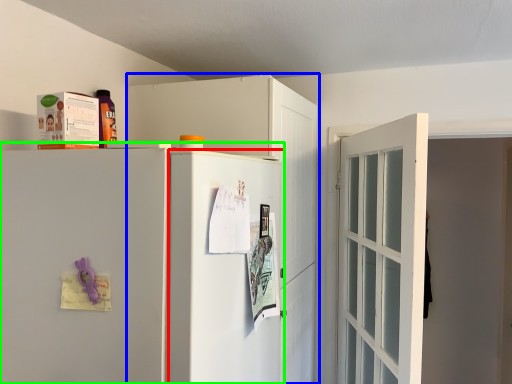
Question: Which is nearer to the screen door (highlighted by a red box)? cabinetry (highlighted by a blue box) or refrigerator (highlighted by a green box).

Choices:
 (A) cabinetry
 (B) refrigerator

Answer: (B)